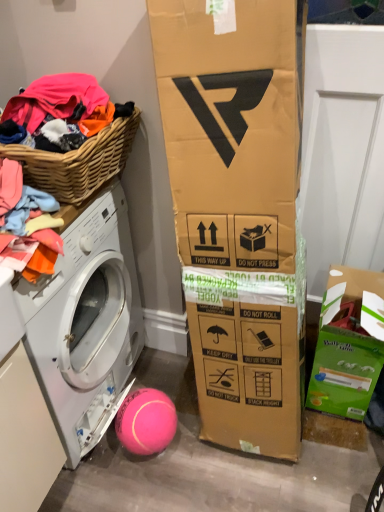
Question: Is green cardboard box at lower right taller or shorter than woven wood basket at left?

Choices:
 (A) short
 (B) tall

Answer: (B)

Question: Does point (337, 310) appear closer or farther from the camera than point (49, 168)?

Choices:
 (A) closer
 (B) farther

Answer: (B)

Question: Estimate the real-world distances between objects in this image. Which object is farther from the woven wood basket at left?

Choices:
 (A) pink rubber ball at lower center
 (B) green cardboard box at lower right
 (C) white glossy washing machine at left

Answer: (B)

Question: Which of these objects is positioned closest to the green cardboard box at lower right?

Choices:
 (A) pink rubber ball at lower center
 (B) woven wood basket at left
 (C) white glossy washing machine at left

Answer: (A)